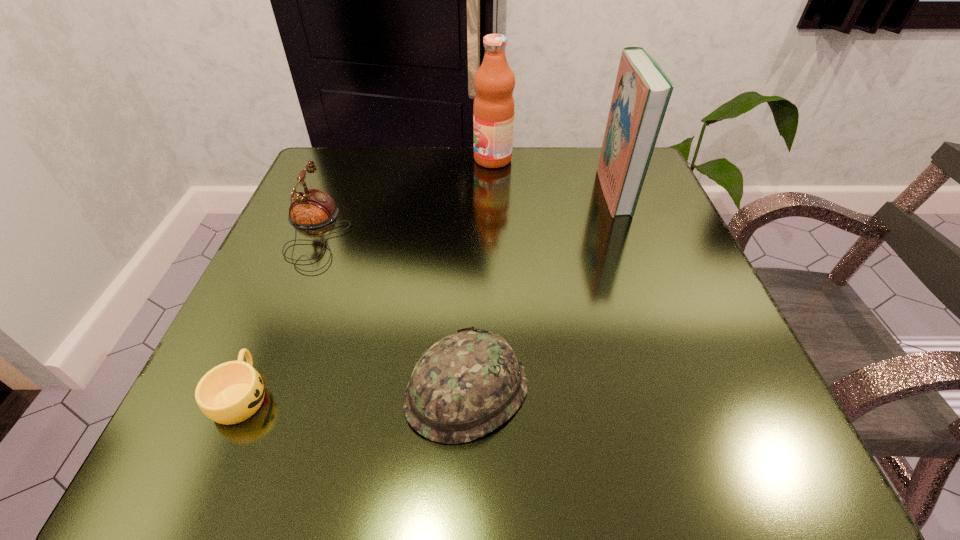
Find the location of a particular element. The image size is (960, 540). fruit juice is located at coordinates (493, 110).

Locate an element on the screen. hardback book is located at coordinates (642, 91).

The height and width of the screenshot is (540, 960). What are the coordinates of `telephone` in the screenshot? It's located at (311, 208).

This screenshot has height=540, width=960. Identify the location of headwear. (467, 384).

Where is `the shortest object`? the shortest object is located at coordinates (231, 392).

At what (x,y) coordinates should I click in order to perform the action: click on free region located on the front label of the fruit juice. Please return your answer as a coordinate pair (x, y). This screenshot has width=960, height=540. Looking at the image, I should click on (372, 159).

The height and width of the screenshot is (540, 960). I want to click on vacant area situated on the front label of the fruit juice, so click(x=376, y=159).

What are the coordinates of `vacant space situated on the front label of the fruit juice` in the screenshot? It's located at (322, 159).

Locate an element on the screen. This screenshot has height=540, width=960. vacant space located on the cover of the rightmost object is located at coordinates (523, 191).

Find the location of a particular element. Image resolution: width=960 pixels, height=540 pixels. vacant space located on the cover of the rightmost object is located at coordinates (463, 191).